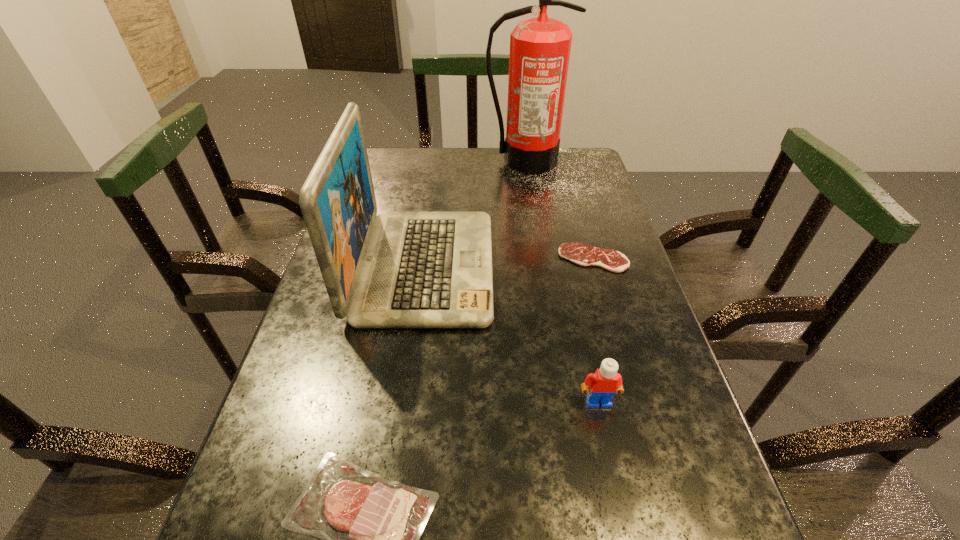
Identify the location of free space that is in between the laptop computer and the third tallest object. This screenshot has width=960, height=540. (511, 334).

You are a GUI agent. You are given a task and a screenshot of the screen. Output one action in this format:
    pyautogui.click(x=<x>, y=<y>)
    Task: Click on the unoccupied position between the fourth farthest object and the fire extinguisher
    This screenshot has width=960, height=540.
    Given the screenshot: What is the action you would take?
    tap(562, 281)

Locate an element on the screen. This screenshot has width=960, height=540. the third closest object relative to the tallest object is located at coordinates (601, 386).

This screenshot has width=960, height=540. I want to click on object that is the nearest to the farthest object, so click(x=396, y=269).

Find the location of a particular element. free space in the image that satisfies the following two spatial constraints: 1. on the front side of the fire extinguisher; 2. on the screen of the laptop computer is located at coordinates (541, 267).